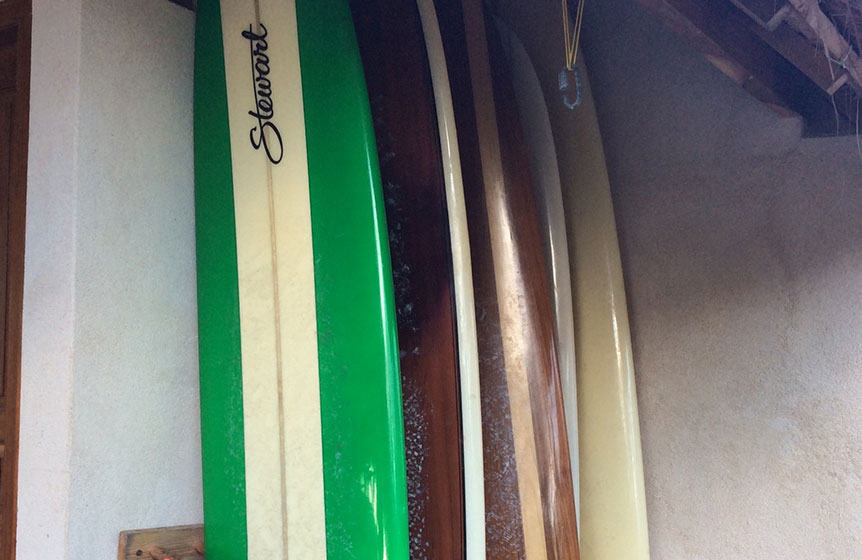
I want to click on wall, so click(784, 402).